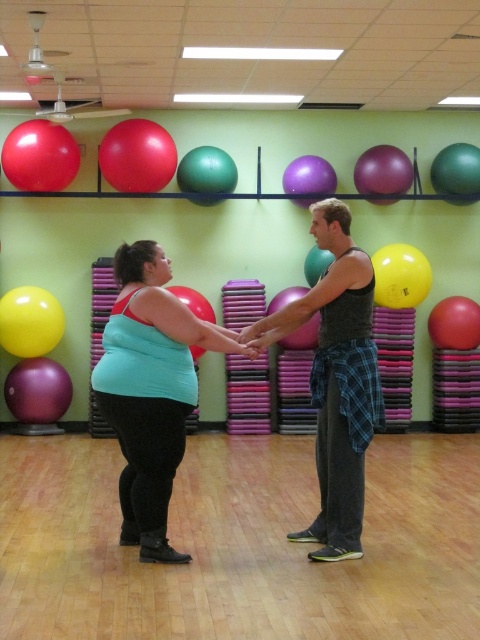
You are a photographer setting up a shoot in the gym. You want to capture both the shiny red balloon at upper center and the green rubber balloon at center in your photo. However, you need to ensure that neither balloon is blocking the other. Is this possible?

Yes, it is possible to capture both the shiny red balloon at upper center and the green rubber balloon at center without either blocking the other because the shiny red balloon at upper center is positioned in front of the green rubber balloon at center, allowing for a layered composition where both are visible.

You are a fitness instructor preparing to throw a rubber ball at center to a participant standing near the matte purple balloon at upper center. Can you accurately throw the ball to them without it hitting any of the exercise balls on the shelves?

The distance between the matte purple balloon at upper center and the rubber ball at center is 2.57 meters. However, the presence of exercise balls on the shelves above might obstruct the path. Since the exact height and arrangement of the balls aren